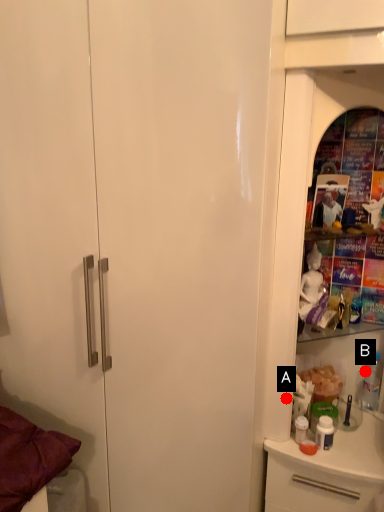
Question: Two points are circled on the image, labeled by A and B beside each circle. Which point is farther to the camera?

Choices:
 (A) A is further
 (B) B is further

Answer: (B)